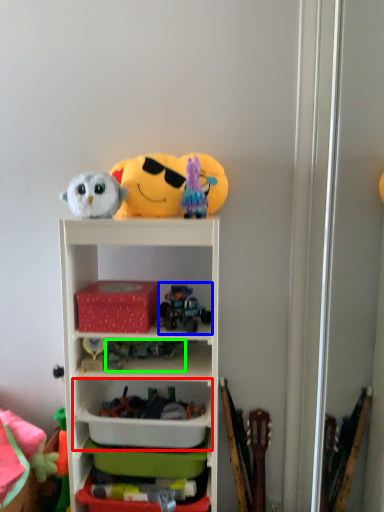
Question: Based on their relative distances, which object is farther from cabinet (highlighted by a red box)? Choose from toy (highlighted by a blue box) and toy (highlighted by a green box).

Choices:
 (A) toy
 (B) toy

Answer: (A)